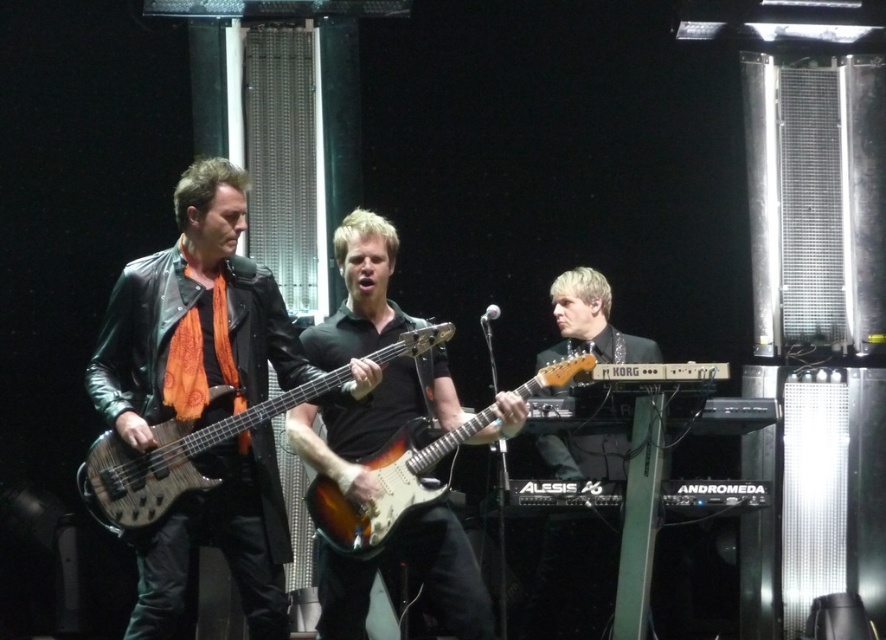
Based on the scene description, which guitar is positioned higher? The wooden electric guitar at center or the sunburst wood electric guitar at center?

The wooden electric guitar at center is positioned higher than the sunburst wood electric guitar at center.

Looking at this image, you are a stagehand preparing to adjust the microphones for the band members. You notice the shiny black guitar at right and the sunburst wood electric guitar at center. Which guitar is positioned lower on the stage?

The shiny black guitar at right is positioned below the sunburst wood electric guitar at center, so it is lower on the stage.